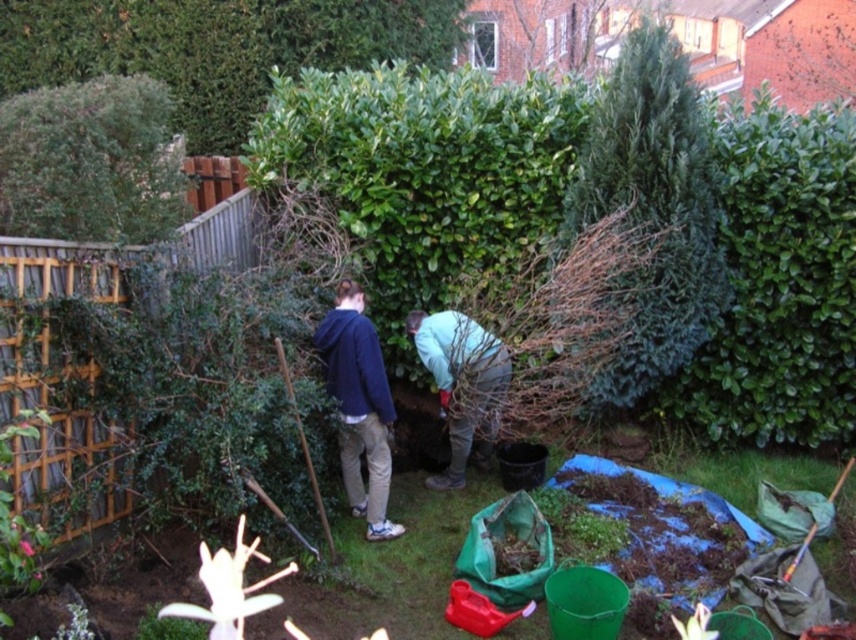
Does green leafy bush at upper center have a lesser width compared to green textured tree at upper right?

In fact, green leafy bush at upper center might be wider than green textured tree at upper right.

Between point (224, 141) and point (666, 163), which one is positioned in front?

Positioned in front is point (666, 163).

Identify the location of green leafy bush at upper center. This screenshot has height=640, width=856. (215, 48).

Locate an element on the screen. The image size is (856, 640). green leafy hedge at upper right is located at coordinates pos(779,282).

Locate an element on the screen. green leafy hedge at upper right is located at coordinates (779, 282).

Does green leafy bush at upper center appear over light blue fabric at center?

Yes.

Between green leafy bush at upper center and light blue fabric at center, which one appears on the left side from the viewer's perspective?

Positioned to the left is green leafy bush at upper center.

Who is more distant from viewer, (x=278, y=67) or (x=426, y=484)?

Positioned behind is point (x=278, y=67).

Identify the location of green leafy bush at upper center. (215, 48).